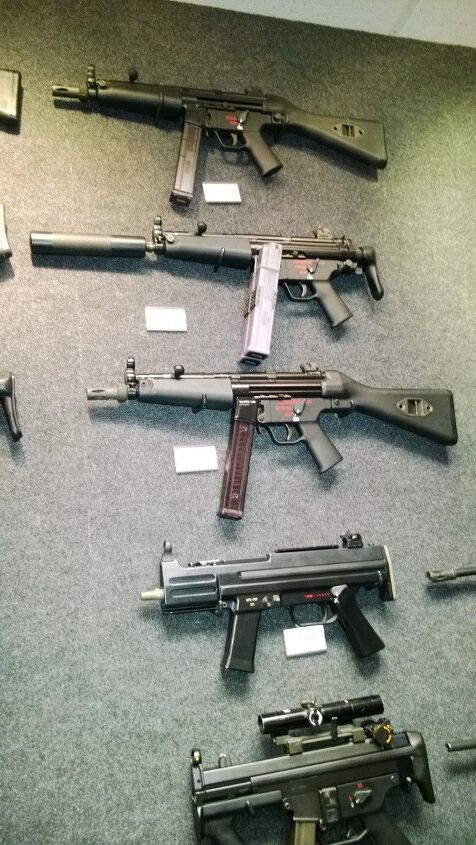
In order to click on wall in this screenshot , I will do `click(305, 11)`.